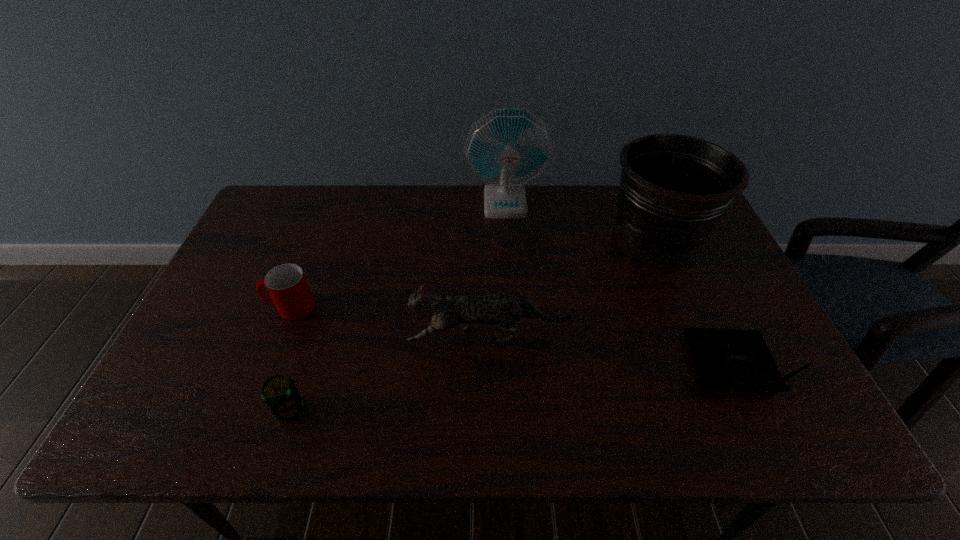
Locate an element on the screen. object located in the left edge section of the desktop is located at coordinates (287, 285).

Find the location of `bucket that is at the right edge`. bucket that is at the right edge is located at coordinates (674, 189).

You are a GUI agent. You are given a task and a screenshot of the screen. Output one action in this format:
    pyautogui.click(x=<x>, y=<y>)
    Task: Click on the router located in the right edge section of the desktop
    
    Given the screenshot: What is the action you would take?
    pyautogui.click(x=733, y=359)

This screenshot has width=960, height=540. Identify the location of object that is at the far right corner. (674, 189).

The height and width of the screenshot is (540, 960). Identify the location of object that is at the near right corner. (733, 359).

Where is `vacant area at the far edge of the desktop`? The height and width of the screenshot is (540, 960). vacant area at the far edge of the desktop is located at coordinates (508, 220).

Identify the location of free space at the near edge of the desktop. The image size is (960, 540). (352, 415).

The height and width of the screenshot is (540, 960). In the image, there is a desktop. Identify the location of vacant space at the right edge. (736, 401).

Find the location of a particular element. free spot between the fifth shortest object and the tallest object is located at coordinates (580, 221).

Locate an element on the screen. Image resolution: width=960 pixels, height=540 pixels. vacant area that lies between the cat and the beer can is located at coordinates coord(389,373).